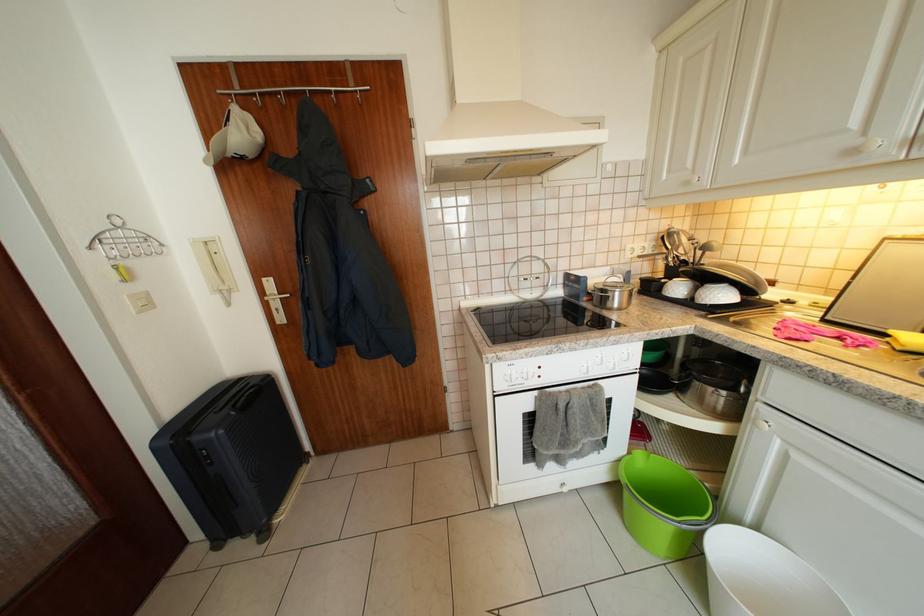
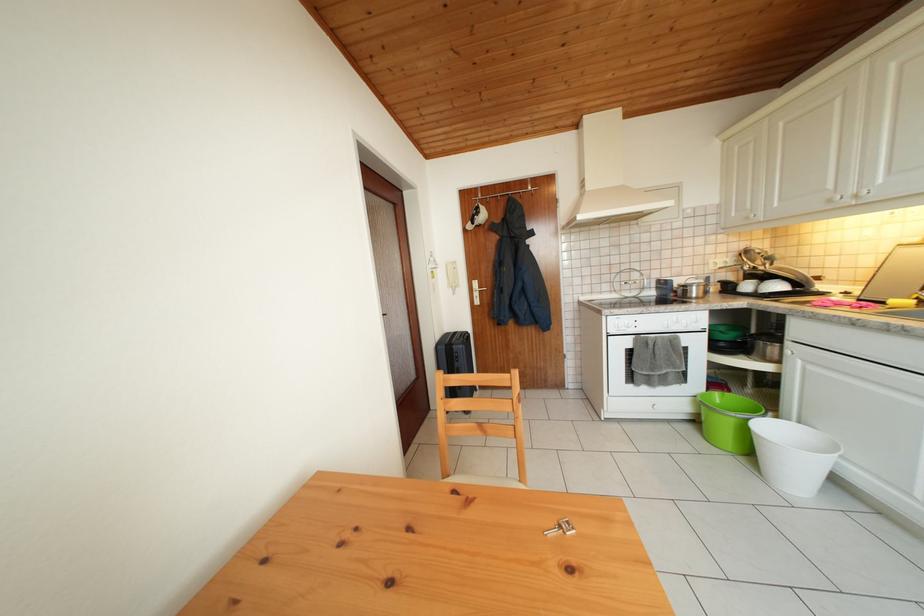
Find the pixel in the second image that matches (626,299) in the first image.

(702, 294)